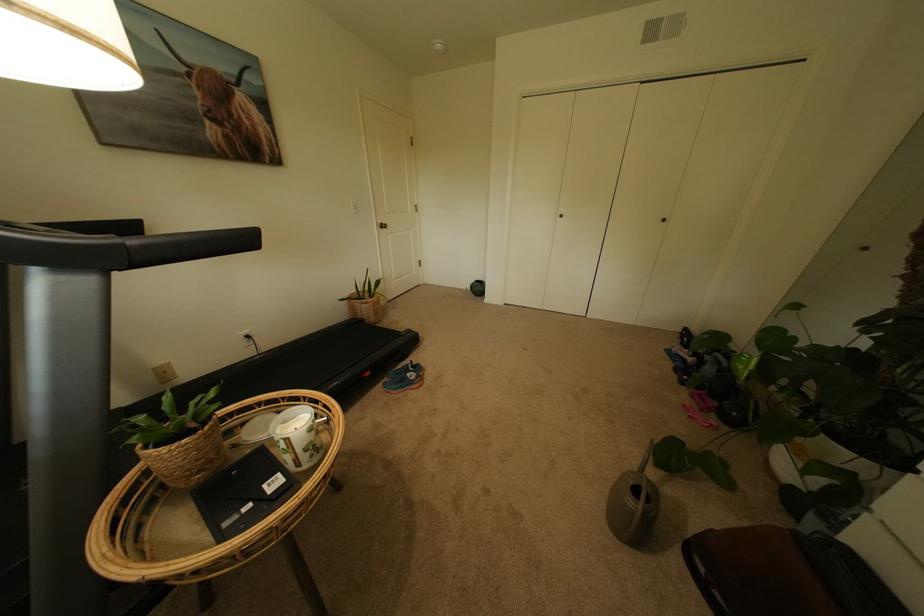
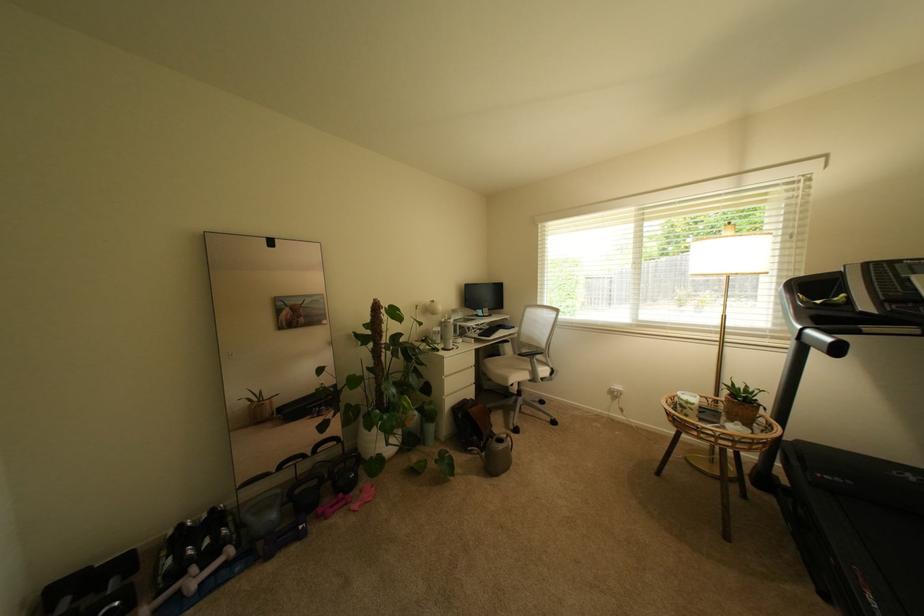
Find the pixel in the second image that matches (709,398) in the first image.

(339, 508)